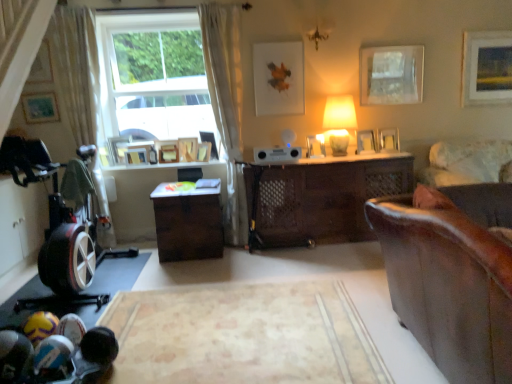
Where is `free spot above wooden picture frame at upper right, which appears as the first picture frame when viewed from the right (from a real-world perspective)`? This screenshot has width=512, height=384. free spot above wooden picture frame at upper right, which appears as the first picture frame when viewed from the right (from a real-world perspective) is located at coordinates (489, 30).